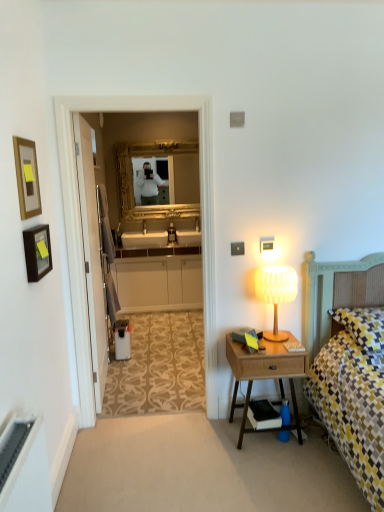
Image resolution: width=384 pixels, height=512 pixels. What do you see at coordinates (265, 376) in the screenshot?
I see `woodenmaterial/texturenightstand at right` at bounding box center [265, 376].

Describe the element at coordinates (37, 252) in the screenshot. The width and height of the screenshot is (384, 512). I see `wooden picture frame at left, which is the 2th picture frame from top to bottom` at that location.

The height and width of the screenshot is (512, 384). Describe the element at coordinates (27, 177) in the screenshot. I see `gold-framed picture at left, the 1th picture frame in the top-to-bottom sequence` at that location.

Find the location of a particular element. white ribbed glass table lamp at right is located at coordinates (276, 293).

Does white matte cabinet at center appear on the right side of gold-framed picture at left, the 1th picture frame in the top-to-bottom sequence?

Yes, white matte cabinet at center is to the right of gold-framed picture at left, the 1th picture frame in the top-to-bottom sequence.

Is white matte cabinet at center taller or shorter than gold-framed picture at left, which is the 2th picture frame from bottom to top?

Clearly, white matte cabinet at center is taller compared to gold-framed picture at left, which is the 2th picture frame from bottom to top.

Is white matte cabinet at center facing towards gold-framed picture at left, which is the 2th picture frame from bottom to top?

Yes, white matte cabinet at center is aimed at gold-framed picture at left, which is the 2th picture frame from bottom to top.

From the image's perspective, is white matte cabinet at center located beneath gold-framed picture at left, which is the 2th picture frame from bottom to top?

Yes.

Does point (121, 145) come behind point (292, 426)?

Yes, point (121, 145) is behind point (292, 426).

Which of these two, gold ornate mirror at center or woodenmaterial/texturenightstand at right, stands taller?

gold ornate mirror at center is taller.

From a real-world perspective, is gold ornate mirror at center positioned over woodenmaterial/texturenightstand at right based on gravity?

Correct, in the physical world, gold ornate mirror at center is higher than woodenmaterial/texturenightstand at right.

Does gold ornate mirror at center have a lesser width compared to woodenmaterial/texturenightstand at right?

Indeed, gold ornate mirror at center has a lesser width compared to woodenmaterial/texturenightstand at right.

Which object is closer to the camera taking this photo, woodenmaterial/texturenightstand at right or wooden picture frame at left, the 1th picture frame positioned from the bottom?

Positioned in front is wooden picture frame at left, the 1th picture frame positioned from the bottom.

Is wooden picture frame at left, the 1th picture frame positioned from the bottom, located within woodenmaterial/texturenightstand at right?

Actually, wooden picture frame at left, the 1th picture frame positioned from the bottom, is outside woodenmaterial/texturenightstand at right.

Which is behind, point (301, 352) or point (37, 229)?

The point (301, 352) is behind.

From their relative heights in the image, would you say woodenmaterial/texturenightstand at right is taller or shorter than wooden picture frame at left, which is the 2th picture frame from top to bottom?

Clearly, woodenmaterial/texturenightstand at right is taller compared to wooden picture frame at left, which is the 2th picture frame from top to bottom.

Considering the sizes of woodenmaterial/texturenightstand at right and gold ornate mirror at center in the image, is woodenmaterial/texturenightstand at right wider or thinner than gold ornate mirror at center?

woodenmaterial/texturenightstand at right is wider than gold ornate mirror at center.

Visually, is woodenmaterial/texturenightstand at right positioned to the left or to the right of gold ornate mirror at center?

Based on their positions, woodenmaterial/texturenightstand at right is located to the right of gold ornate mirror at center.

Between woodenmaterial/texturenightstand at right and gold ornate mirror at center, which one has smaller size?

With smaller size is gold ornate mirror at center.

Image resolution: width=384 pixels, height=512 pixels. I want to click on nightstand below the gold ornate mirror at center (from a real-world perspective), so click(265, 376).

Is white ribbed glass table lamp at right to the left of wooden picture frame at left, which is the 2th picture frame from top to bottom, from the viewer's perspective?

Incorrect, white ribbed glass table lamp at right is not on the left side of wooden picture frame at left, which is the 2th picture frame from top to bottom.

Is white ribbed glass table lamp at right closer to camera compared to wooden picture frame at left, the 1th picture frame positioned from the bottom?

No, it is behind wooden picture frame at left, the 1th picture frame positioned from the bottom.

Is white ribbed glass table lamp at right positioned far away from wooden picture frame at left, the 1th picture frame positioned from the bottom?

Yes, white ribbed glass table lamp at right is far from wooden picture frame at left, the 1th picture frame positioned from the bottom.

The image size is (384, 512). I want to click on nightstand on the left of white ribbed glass table lamp at right, so click(x=265, y=376).

Is white ribbed glass table lamp at right facing towards woodenmaterial/texturenightstand at right?

No.

Can you tell me how much white ribbed glass table lamp at right and woodenmaterial/texturenightstand at right differ in facing direction?

The angular difference between white ribbed glass table lamp at right and woodenmaterial/texturenightstand at right is 2.75e-05 degrees.

From the image's perspective, is white ribbed glass table lamp at right located beneath woodenmaterial/texturenightstand at right?

No, from the image's perspective, white ribbed glass table lamp at right is not beneath woodenmaterial/texturenightstand at right.

Find the location of a particular element. Image resolution: width=384 pixels, height=512 pixels. picture frame that is the 2nd one above the yellow checkered pillow at right (from a real-world perspective) is located at coordinates (27, 177).

Could you tell me if gold-framed picture at left, the 1th picture frame in the top-to-bottom sequence, is facing yellow checkered pillow at right?

Yes.

From a real-world perspective, is gold-framed picture at left, which is the 2th picture frame from bottom to top, below yellow checkered pillow at right?

Incorrect, from a real-world perspective, gold-framed picture at left, which is the 2th picture frame from bottom to top, is higher than yellow checkered pillow at right.

Does gold-framed picture at left, which is the 2th picture frame from bottom to top, touch yellow checkered pillow at right?

No, gold-framed picture at left, which is the 2th picture frame from bottom to top, is not with yellow checkered pillow at right.

I want to click on cabinetry lying on the right of gold-framed picture at left, which is the 2th picture frame from bottom to top, so click(x=159, y=283).

Where is `mirror behind the woodenmaterial/texturenightstand at right`? This screenshot has width=384, height=512. mirror behind the woodenmaterial/texturenightstand at right is located at coordinates (132, 180).

Looking at this image, based on their spatial positions, is woodenmaterial/texturenightstand at right or wooden picture frame at left, which is the 2th picture frame from top to bottom, further from gold ornate mirror at center?

The object further to gold ornate mirror at center is wooden picture frame at left, which is the 2th picture frame from top to bottom.

Looking at the image, which one is located closer to white matte cabinet at center, yellow checkered pillow at right or white ribbed glass table lamp at right?

Based on the image, white ribbed glass table lamp at right appears to be nearer to white matte cabinet at center.

Estimate the real-world distances between objects in this image. Which object is closer to gold-framed picture at left, which is the 2th picture frame from bottom to top, gold ornate mirror at center or yellow checkered pillow at right?

yellow checkered pillow at right lies closer to gold-framed picture at left, which is the 2th picture frame from bottom to top, than the other object.

Considering their positions, is wooden picture frame at left, which is the 2th picture frame from top to bottom, positioned closer to yellow checkered pillow at right than gold-framed picture at left, which is the 2th picture frame from bottom to top?

wooden picture frame at left, which is the 2th picture frame from top to bottom, is positioned closer to the anchor yellow checkered pillow at right.

When comparing their distances from gold-framed picture at left, which is the 2th picture frame from bottom to top, does yellow checkered pillow at right or gold ornate mirror at center seem further?

The object further to gold-framed picture at left, which is the 2th picture frame from bottom to top, is gold ornate mirror at center.

From the image, which object appears to be farther from gold ornate mirror at center, woodenmaterial/texturenightstand at right or gold-framed picture at left, which is the 2th picture frame from bottom to top?

gold-framed picture at left, which is the 2th picture frame from bottom to top, lies further to gold ornate mirror at center than the other object.

Estimate the real-world distances between objects in this image. Which object is further from white matte cabinet at center, wooden picture frame at left, the 1th picture frame positioned from the bottom, or gold ornate mirror at center?

wooden picture frame at left, the 1th picture frame positioned from the bottom.

From the image, which object appears to be nearer to gold-framed picture at left, which is the 2th picture frame from bottom to top, woodenmaterial/texturenightstand at right or white ribbed glass table lamp at right?

Based on the image, white ribbed glass table lamp at right appears to be nearer to gold-framed picture at left, which is the 2th picture frame from bottom to top.

At what (x,y) coordinates should I click in order to perform the action: click on nightstand between gold-framed picture at left, which is the 2th picture frame from bottom to top, and gold ornate mirror at center in the front-back direction. Please return your answer as a coordinate pair (x, y). Looking at the image, I should click on (265, 376).

You are a GUI agent. You are given a task and a screenshot of the screen. Output one action in this format:
    pyautogui.click(x=<x>, y=<y>)
    Task: Click on the table lamp between wooden picture frame at left, which is the 2th picture frame from top to bottom, and white matte cabinet at center, along the z-axis
    
    Given the screenshot: What is the action you would take?
    pyautogui.click(x=276, y=293)

The image size is (384, 512). Find the location of `table lamp between gold-framed picture at left, the 1th picture frame in the top-to-bottom sequence, and white matte cabinet at center in the front-back direction`. table lamp between gold-framed picture at left, the 1th picture frame in the top-to-bottom sequence, and white matte cabinet at center in the front-back direction is located at coordinates (276, 293).

Identify the location of nightstand between yellow checkered pillow at right and white matte cabinet at center in the front-back direction. Image resolution: width=384 pixels, height=512 pixels. (265, 376).